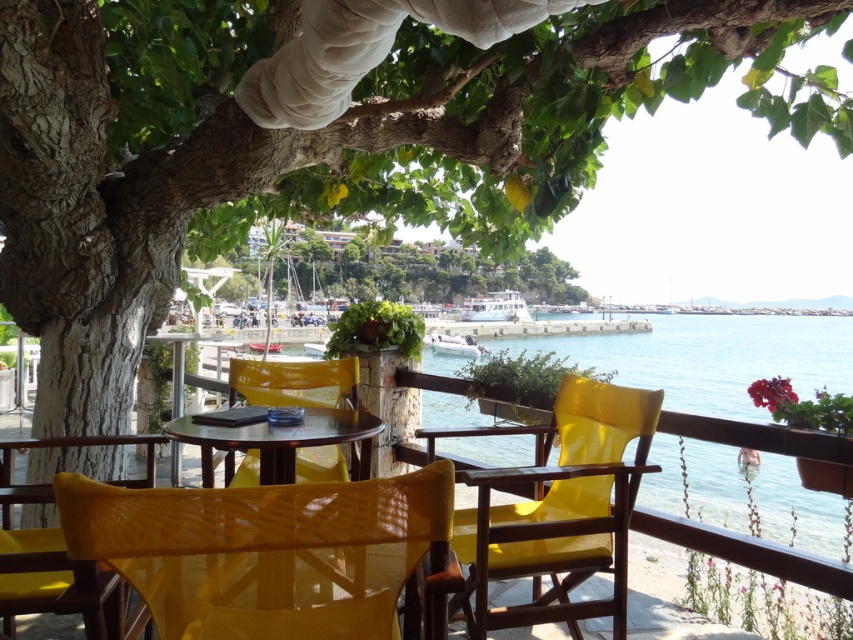
Question: Does yellow fabric chair at center have a smaller size compared to green leafy tree at center?

Choices:
 (A) no
 (B) yes

Answer: (B)

Question: Which object appears farthest from the camera in this image?

Choices:
 (A) wooden table at center
 (B) yellow woven chair at lower left

Answer: (A)

Question: Which object is closer to the camera taking this photo?

Choices:
 (A) wooden table at center
 (B) matte yellow chair at lower left
 (C) green leafy tree at center

Answer: (B)

Question: Is yellow fabric chair at center thinner than glossy wood table at center?

Choices:
 (A) no
 (B) yes

Answer: (B)

Question: Can you confirm if green leafy tree at center is positioned below wooden table at center?

Choices:
 (A) yes
 (B) no

Answer: (B)

Question: Which object appears farthest from the camera in this image?

Choices:
 (A) yellow plastic chair at center
 (B) green leafy tree at center
 (C) glossy wood table at center

Answer: (B)